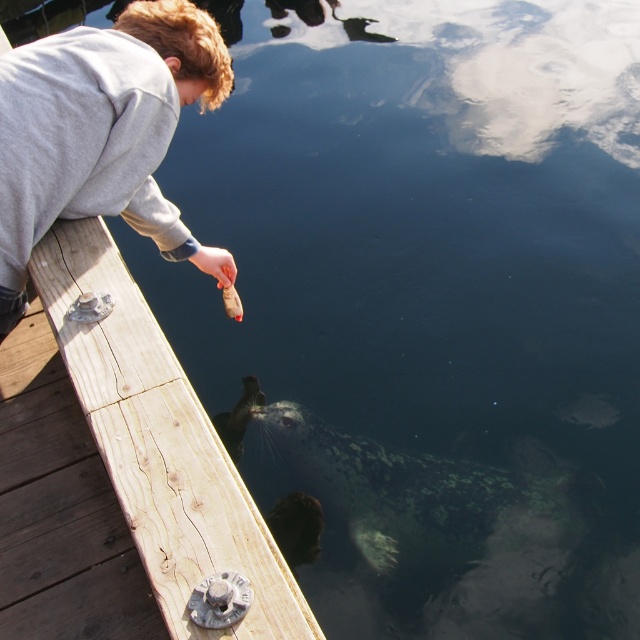
Is brown wooden dock at lower left below gray matte sweatshirt at upper left?

Correct, brown wooden dock at lower left is located below gray matte sweatshirt at upper left.

At what (x,y) coordinates should I click in order to perform the action: click on brown wooden dock at lower left. Please return your answer as a coordinate pair (x, y). The image size is (640, 640). Looking at the image, I should click on point(161,444).